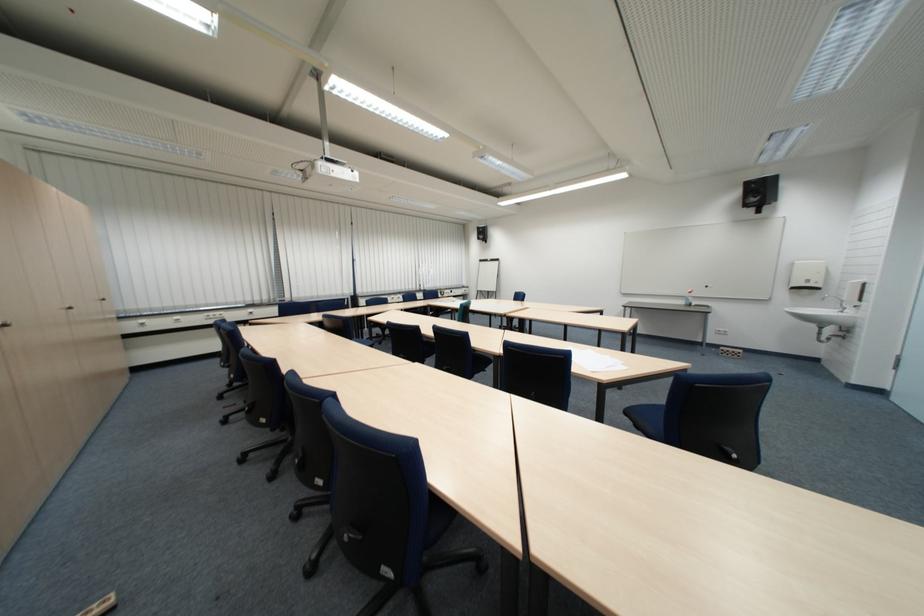
This screenshot has width=924, height=616. Find the location of `chair adjustment lever`. chair adjustment lever is located at coordinates 348,537.